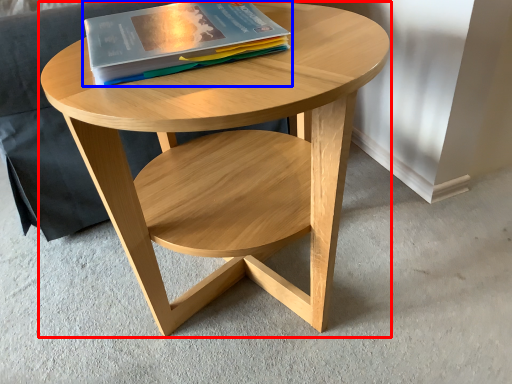
Question: Which point is closer to the camera, coffee table (highlighted by a red box) or book (highlighted by a blue box)?

Choices:
 (A) coffee table
 (B) book

Answer: (A)